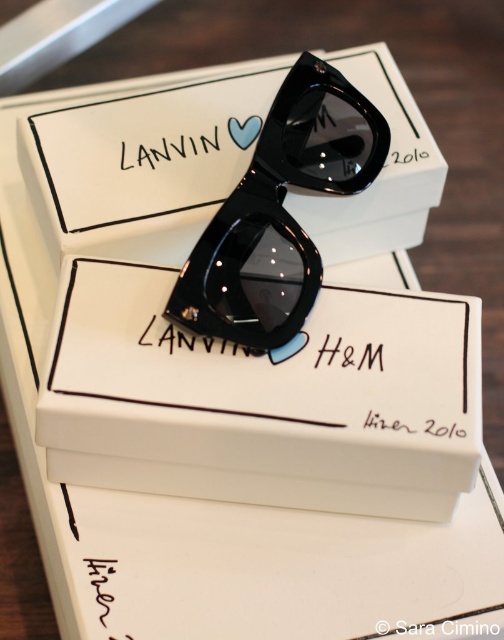
Is white cardboard box at upper center taller than glossy black sunglasses at center?

No, white cardboard box at upper center is not taller than glossy black sunglasses at center.

The height and width of the screenshot is (640, 504). I want to click on white cardboard box at upper center, so click(x=144, y=163).

Which of these two, white cardboard box at center or white cardboard box at upper center, stands taller?

With more height is white cardboard box at center.

Between white cardboard box at center and white cardboard box at upper center, which one is positioned higher?

white cardboard box at upper center is higher up.

Where is `white cardboard box at center`? white cardboard box at center is located at coordinates (265, 400).

The image size is (504, 640). Identify the location of white cardboard box at center. (265, 400).

Does white cardboard box at center lie behind glossy black sunglasses at center?

No, white cardboard box at center is closer to the viewer.

Measure the distance between point (129,484) and camera.

They are 3.71 feet apart.

Which is behind, point (392, 484) or point (226, 268)?

Point (226, 268)

Image resolution: width=504 pixels, height=640 pixels. Find the location of `white cardboard box at center`. white cardboard box at center is located at coordinates (265, 400).